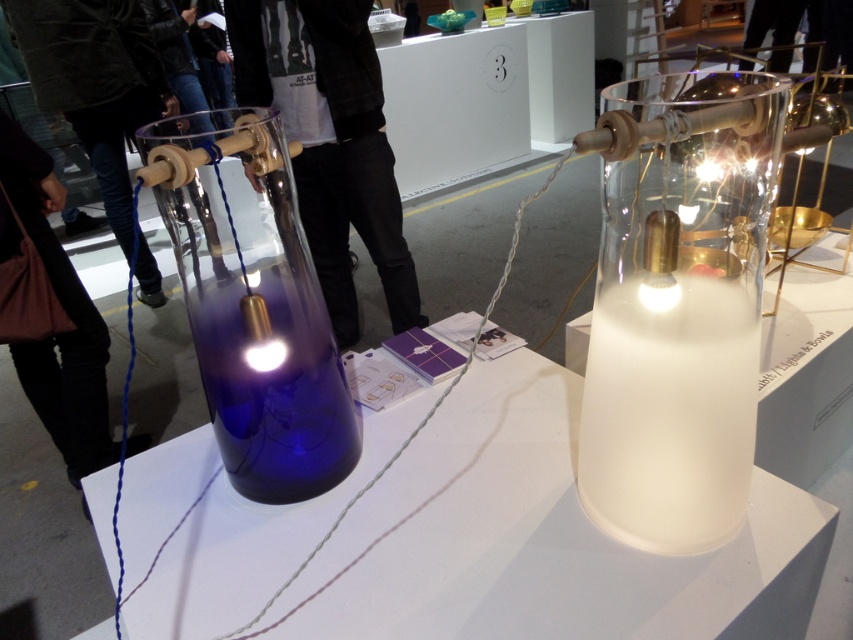
Which is above, translucent white string at center or translucent white lampshade at center?

translucent white lampshade at center

Does point (543, 189) come farther from viewer compared to point (647, 285)?

No, it is in front of (647, 285).

Is point (293, 576) positioned behind point (670, 289)?

Yes, point (293, 576) is behind point (670, 289).

The image size is (853, 640). Identify the location of translucent white string at center. (428, 410).

Can you confirm if black cotton pants at left is bigger than matte gold bulb at center?

Yes, black cotton pants at left is bigger than matte gold bulb at center.

Who is more distant from viewer, (241, 61) or (264, 355)?

Point (241, 61)

Is point (315, 180) closer to camera compared to point (260, 356)?

No, it is not.

Where is `black cotton pants at left`? black cotton pants at left is located at coordinates (329, 141).

Measure the distance between translucent white string at center and translucent glass lamp at center.

translucent white string at center is 18.18 inches from translucent glass lamp at center.

Does point (312, 556) come closer to viewer compared to point (715, 163)?

No.

Between point (410, 429) and point (711, 170), which one is positioned behind?

The point (410, 429) is behind.

This screenshot has width=853, height=640. What are the coordinates of `translucent white string at center` in the screenshot? It's located at (428, 410).